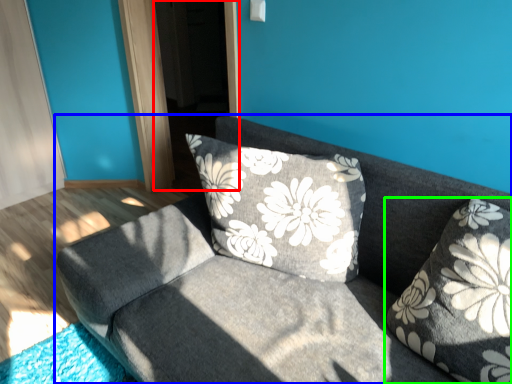
Question: Considering the real-world distances, which object is closest to screen door (highlighted by a red box)? studio couch (highlighted by a blue box) or pillow (highlighted by a green box).

Choices:
 (A) studio couch
 (B) pillow

Answer: (A)